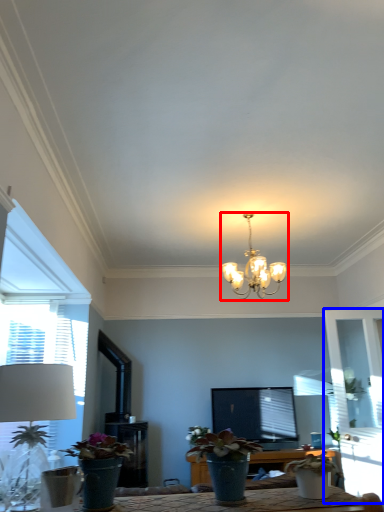
Question: Which point is further to the camera, lamp (highlighted by a red box) or glass door (highlighted by a blue box)?

Choices:
 (A) lamp
 (B) glass door

Answer: (B)